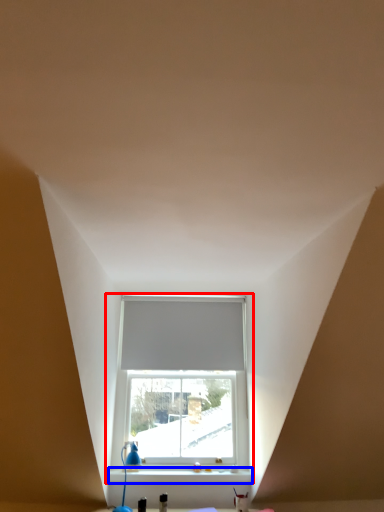
Question: Which object appears closest to the camera in this image, window (highlighted by a red box) or window sill (highlighted by a blue box)?

Choices:
 (A) window
 (B) window sill

Answer: (B)